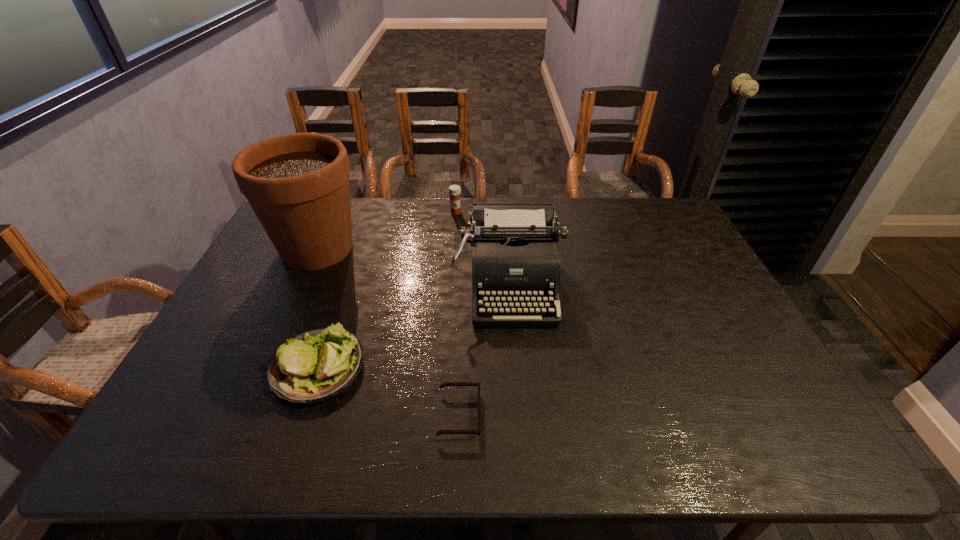
The width and height of the screenshot is (960, 540). Find the location of `vacant region between the second shortest object and the third shortest object`. vacant region between the second shortest object and the third shortest object is located at coordinates (387, 290).

Where is `free space between the lettuce and the typewriter`? The image size is (960, 540). free space between the lettuce and the typewriter is located at coordinates 414,326.

Image resolution: width=960 pixels, height=540 pixels. In order to click on vacant area between the tallest object and the typewriter in this screenshot , I will do [x=414, y=266].

Locate an element on the screen. blank region between the shortest object and the flowerpot is located at coordinates (389, 331).

Locate an element on the screen. unoccupied position between the second shortest object and the typewriter is located at coordinates (414, 326).

Identify the location of vacant space in between the farthest object and the sunglasses. The height and width of the screenshot is (540, 960). (458, 313).

Where is `free area in between the tallest object and the typewriter`? This screenshot has width=960, height=540. free area in between the tallest object and the typewriter is located at coordinates (414, 266).

Where is `vacant area that lies between the fourth tallest object and the third shortest object`? vacant area that lies between the fourth tallest object and the third shortest object is located at coordinates (387, 290).

You are a GUI agent. You are given a task and a screenshot of the screen. Output one action in this format:
    pyautogui.click(x=<x>, y=<y>)
    Task: Click on the vacant area between the second tallest object and the shortest object
    
    Given the screenshot: What is the action you would take?
    pyautogui.click(x=485, y=349)

Select which object appears as the closest to the shortest object. Please provide its 2D coordinates. Your answer should be formatted as a tuple, i.e. [(x, y)], where the tuple contains the x and y coordinates of a point satisfying the conditions above.

[(317, 365)]